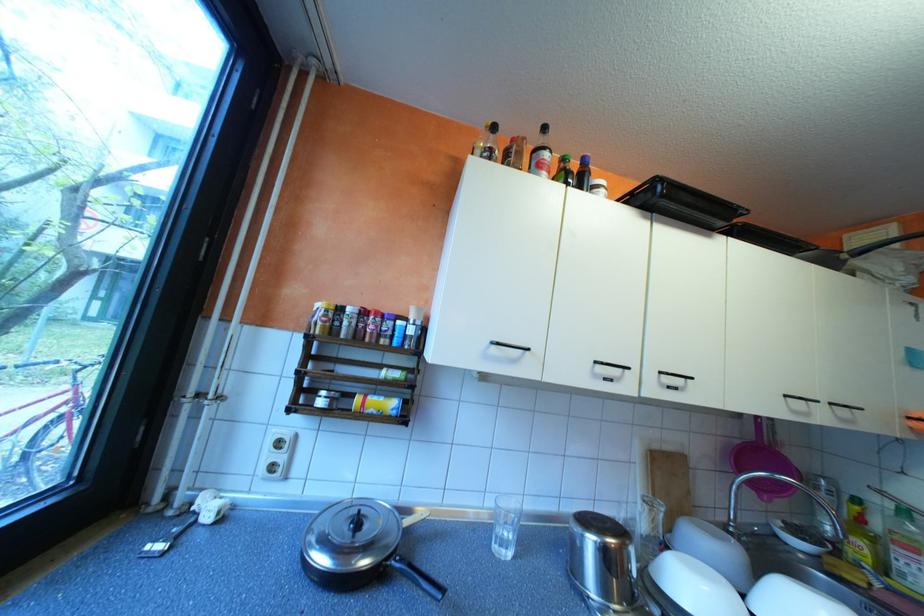
Find where to lift the pan lid handle. Please return your answer as a coordinate pair (x, y).

(416, 515)